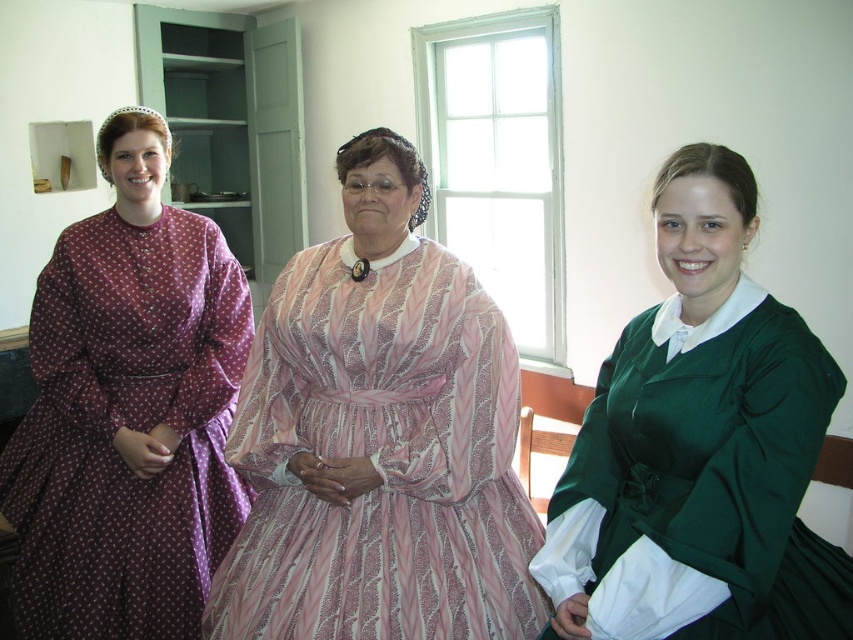
You are a photographer setting up a shoot in this historical room. You need to adjust the lighting so that the green satin dress at center and the purple printed dress at left are both well illuminated. Since the window is the only light source, where should you place the window relative to the dresses?

The green satin dress at center is positioned under the purple printed dress at left, so the window should be placed to the left side of the room to ensure both dresses receive adequate light.

Based on the photo, you are standing in the room and want to place a small decoration between the two points marked as point (236, 433) and point (802, 592). Which point should the decoration be closer to in order to appear closer to the camera?

The decoration should be closer to point (236, 433) because it is further to the camera than point (802, 592).